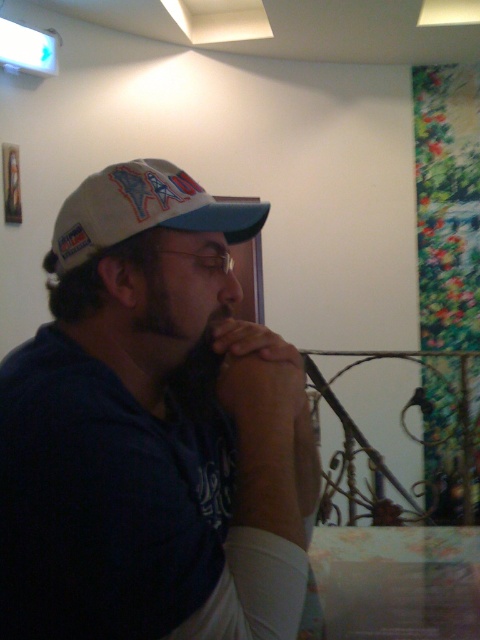
Question: Does white fabric shirt at center appear on the left side of white fabric baseball cap at left?

Choices:
 (A) no
 (B) yes

Answer: (A)

Question: Which of the following is the farthest from the observer?

Choices:
 (A) matte skin jaw at center
 (B) white fabric baseball cap at left
 (C) brown leather hand at center
 (D) white fabric shirt at center

Answer: (A)

Question: Where is white fabric shirt at center located in relation to brown leather hand at center in the image?

Choices:
 (A) below
 (B) above

Answer: (A)

Question: Which point appears closest to the camera in this image?

Choices:
 (A) (144, 557)
 (B) (112, 202)
 (C) (256, 337)

Answer: (A)

Question: Which object is positioned closest to the brown leather hand at center?

Choices:
 (A) white fabric baseball cap at left
 (B) matte skin jaw at center
 (C) white fabric shirt at center

Answer: (B)

Question: Is white fabric baseball cap at left thinner than matte skin jaw at center?

Choices:
 (A) yes
 (B) no

Answer: (B)